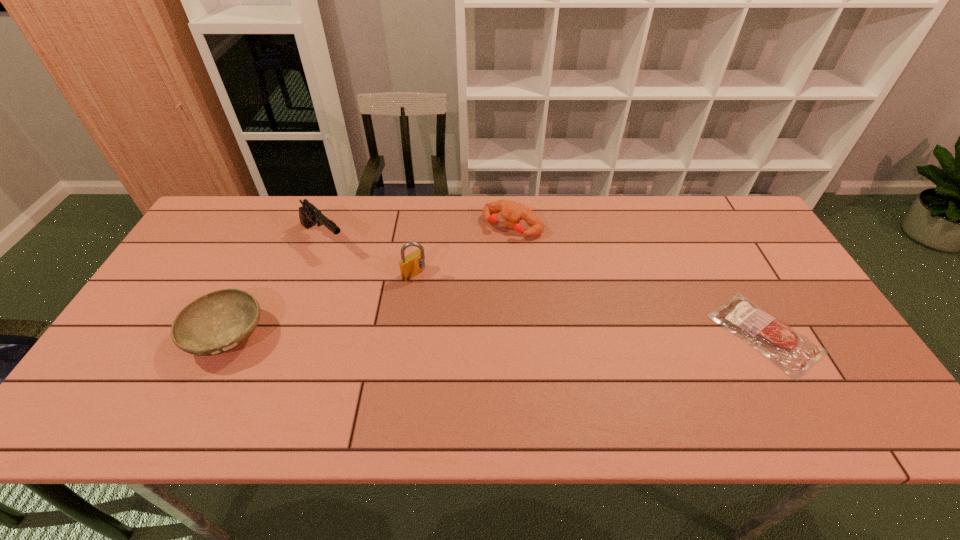
At what (x,y) coordinates should I click in order to perform the action: click on free space between the fourth object from left to right and the bowl. Please return your answer as a coordinate pair (x, y). Looking at the image, I should click on (371, 281).

Find the location of a particular element. The image size is (960, 540). empty location between the second object from right to left and the gun is located at coordinates (418, 233).

At what (x,y) coordinates should I click in order to perform the action: click on vacant area that lies between the third nearest object and the bowl. Please return your answer as a coordinate pair (x, y). The image size is (960, 540). Looking at the image, I should click on (322, 305).

Identify which object is the nearest to the bowl. Please provide its 2D coordinates. Your answer should be formatted as a tuple, i.e. [(x, y)], where the tuple contains the x and y coordinates of a point satisfying the conditions above.

[(309, 215)]

Locate an element on the screen. object that is the fourth closest to the third object from right to left is located at coordinates (795, 354).

Where is `free space that satisfies the following two spatial constraints: 1. on the front side of the second object from right to left; 2. on the left side of the rightmost object`? free space that satisfies the following two spatial constraints: 1. on the front side of the second object from right to left; 2. on the left side of the rightmost object is located at coordinates (521, 334).